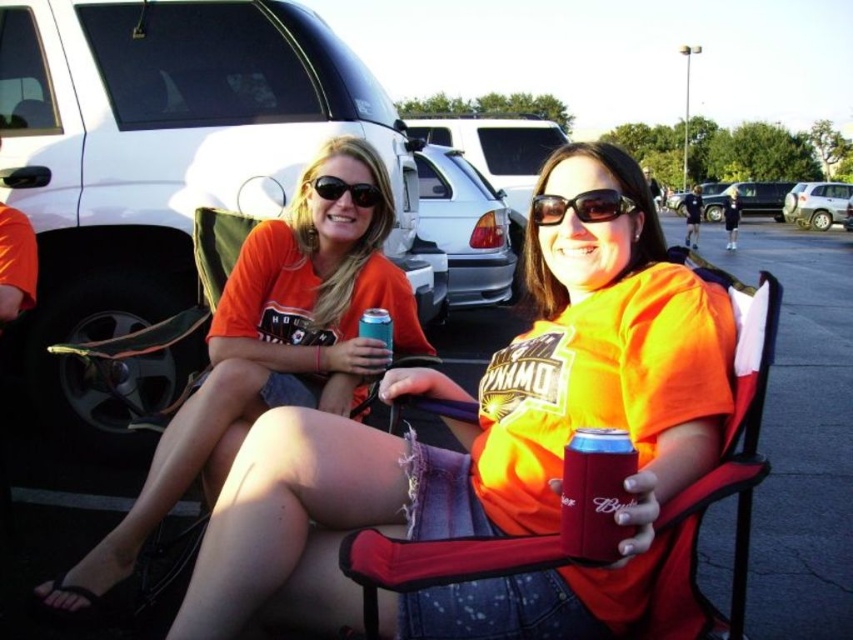
Question: Is white matte sedan at center above silver metallic suv at right?

Choices:
 (A) no
 (B) yes

Answer: (A)

Question: Is orange cotton shirt at center further to camera compared to silver metallic suv at right?

Choices:
 (A) no
 (B) yes

Answer: (A)

Question: Does orange cotton shirt at center have a smaller size compared to metallic silver can at center?

Choices:
 (A) yes
 (B) no

Answer: (B)

Question: Which of the following is the closest to the observer?

Choices:
 (A) (608, 445)
 (B) (245, 392)

Answer: (A)

Question: Which of the following is the closest to the observer?

Choices:
 (A) silver metallic suv at right
 (B) sunglasses at center

Answer: (B)

Question: Considering the real-world distances, which object is farthest from the metallic silver can at center?

Choices:
 (A) orange cotton shirt at center
 (B) orange fabric shirt at center
 (C) white matte sedan at center
 (D) metallic silver suv at center

Answer: (D)